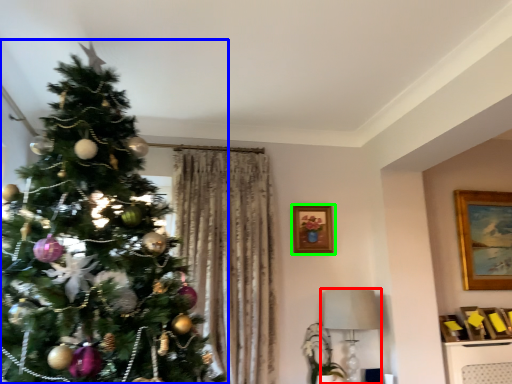
Question: Considering the real-world distances, which object is farthest from lamp (highlighted by a red box)? christmas tree (highlighted by a blue box) or picture frame (highlighted by a green box)?

Choices:
 (A) christmas tree
 (B) picture frame

Answer: (A)